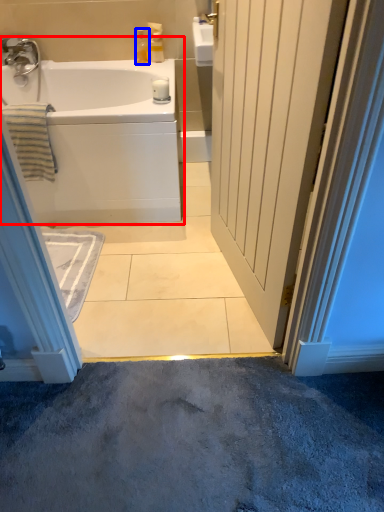
Question: Which point is further to the camera, bathtub (highlighted by a red box) or toiletry (highlighted by a blue box)?

Choices:
 (A) bathtub
 (B) toiletry

Answer: (B)